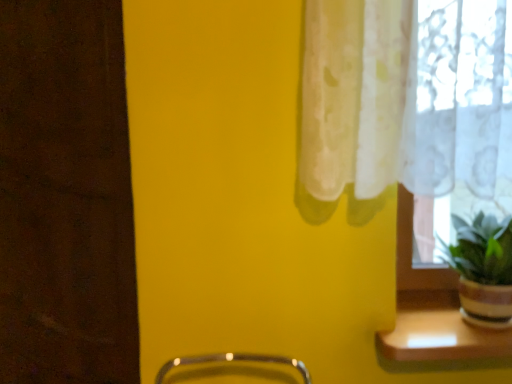
Locate an element on the screen. This screenshot has height=384, width=512. free point above wooden shelf at lower right (from a real-world perspective) is located at coordinates (443, 319).